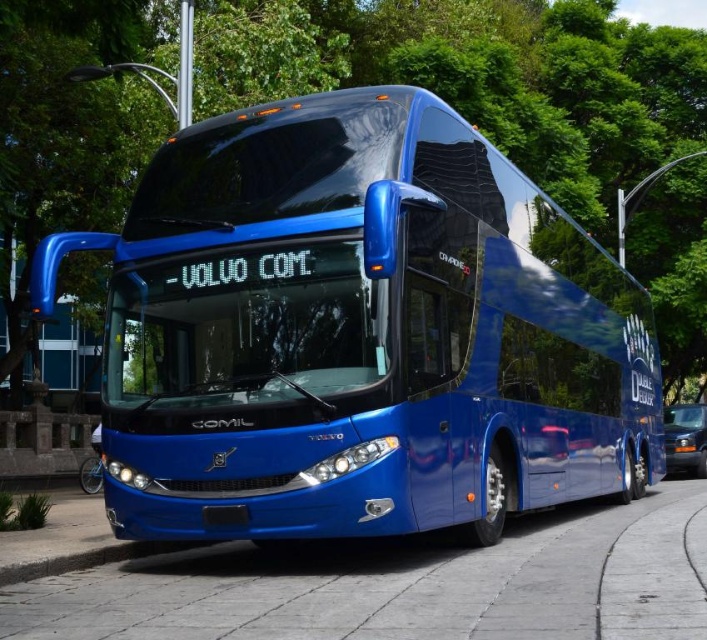
Is cobblestone pavement at center to the right of metallic silver car at lower right from the viewer's perspective?

No, cobblestone pavement at center is not to the right of metallic silver car at lower right.

Between point (110, 566) and point (677, 460), which one is positioned behind?

Positioned behind is point (677, 460).

Locate an element on the screen. The width and height of the screenshot is (707, 640). cobblestone pavement at center is located at coordinates (397, 586).

The image size is (707, 640). I want to click on cobblestone pavement at center, so click(397, 586).

Is point (404, 168) positioned after point (684, 584)?

Yes, it is behind point (684, 584).

Does point (607, 323) come in front of point (23, 600)?

No, (607, 323) is behind (23, 600).

The height and width of the screenshot is (640, 707). What are the coordinates of `glossy blue bus at center` in the screenshot? It's located at (358, 332).

Between point (503, 218) and point (701, 406), which one is positioned behind?

The point (701, 406) is behind.

Describe the element at coordinates (358, 332) in the screenshot. The width and height of the screenshot is (707, 640). I see `glossy blue bus at center` at that location.

Is point (239, 372) closer to camera compared to point (701, 445)?

Yes, it is.

Identify the location of glossy blue bus at center. (358, 332).